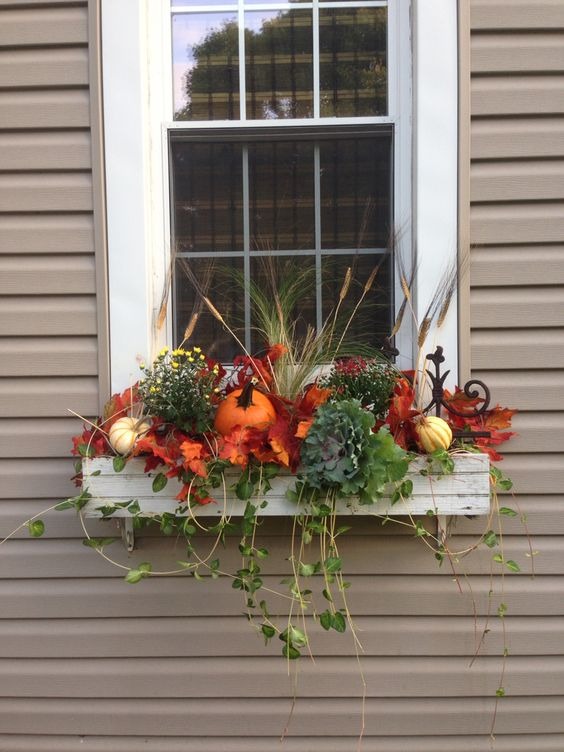
Identify the location of artificial autumn leaves. (496, 423), (277, 444), (191, 444), (118, 399), (155, 455), (315, 401), (275, 441), (402, 402), (458, 402).